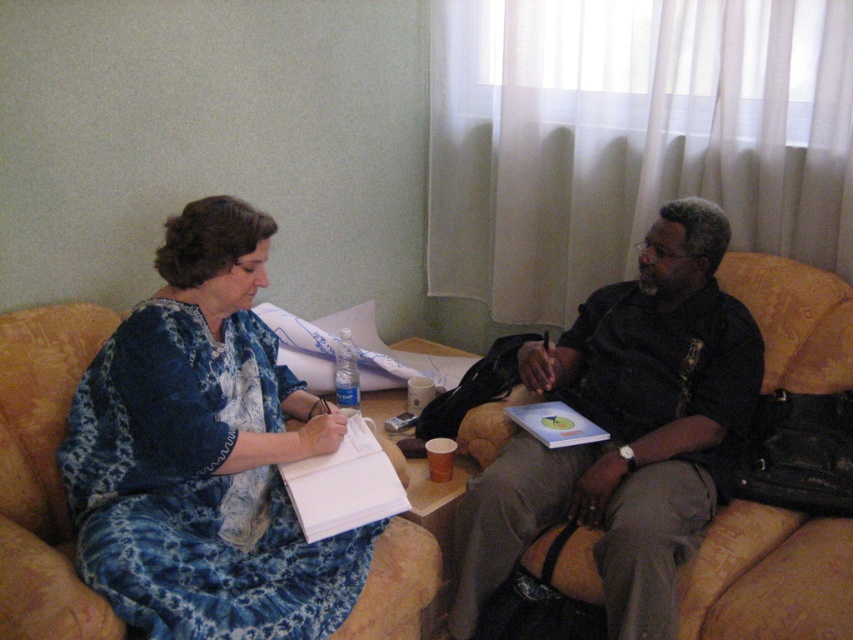
Question: Is blue printed dress at left closer to the viewer compared to dark brown leather jacket at center?

Choices:
 (A) yes
 (B) no

Answer: (A)

Question: Among these objects, which one is nearest to the camera?

Choices:
 (A) dark brown leather jacket at center
 (B) blue printed dress at left

Answer: (B)

Question: From the image, what is the correct spatial relationship of blue printed dress at left in relation to dark brown leather jacket at center?

Choices:
 (A) right
 (B) left

Answer: (B)

Question: Is blue printed dress at left behind dark brown leather jacket at center?

Choices:
 (A) no
 (B) yes

Answer: (A)